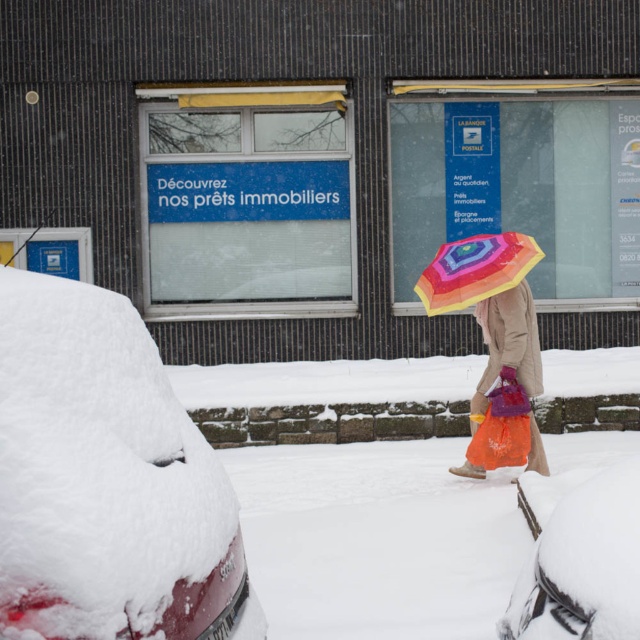
Question: Considering the real-world distances, which object is farthest from the snow-covered car at left?

Choices:
 (A) rainbow fabric umbrella at center
 (B) snow-covered car at lower right
 (C) rainbow plastic umbrella at center

Answer: (C)

Question: Can you confirm if rainbow plastic umbrella at center is positioned above rainbow fabric umbrella at center?

Choices:
 (A) no
 (B) yes

Answer: (A)

Question: Can you confirm if snow-covered car at left is positioned above snow-covered car at lower right?

Choices:
 (A) no
 (B) yes

Answer: (B)

Question: Which point appears farthest from the camera in this image?

Choices:
 (A) (504, 320)
 (B) (202, 480)
 (C) (593, 589)

Answer: (A)

Question: Is snow-covered car at left smaller than rainbow plastic umbrella at center?

Choices:
 (A) yes
 (B) no

Answer: (B)

Question: Which of these objects is positioned farthest from the snow-covered car at left?

Choices:
 (A) snow-covered car at lower right
 (B) rainbow plastic umbrella at center
 (C) rainbow fabric umbrella at center

Answer: (B)